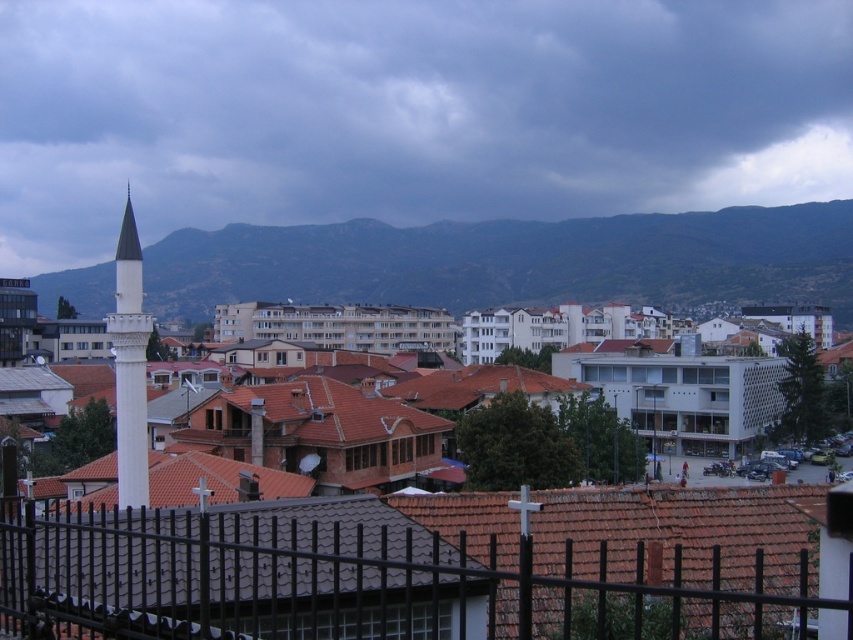
Can you confirm if dark gray cloud at upper center is shorter than white marble minaret at left?

No, dark gray cloud at upper center is not shorter than white marble minaret at left.

Can you confirm if dark gray cloud at upper center is bigger than white marble minaret at left?

Indeed, dark gray cloud at upper center has a larger size compared to white marble minaret at left.

At what (x,y) coordinates should I click in order to perform the action: click on dark gray cloud at upper center. Please return your answer as a coordinate pair (x, y). This screenshot has width=853, height=640. Looking at the image, I should click on (408, 113).

Locate an element on the screen. dark gray cloud at upper center is located at coordinates (408, 113).

Does dark gray cloud at upper center appear over black metal fence at lower center?

Correct, dark gray cloud at upper center is located above black metal fence at lower center.

Where is `dark gray cloud at upper center`? This screenshot has height=640, width=853. dark gray cloud at upper center is located at coordinates (408, 113).

Which is behind, point (218, 161) or point (91, 513)?

Positioned behind is point (218, 161).

I want to click on dark gray cloud at upper center, so (x=408, y=113).

Between dark gray cloud at upper center and green textured mountain at upper center, which one has less height?

green textured mountain at upper center is shorter.

Does dark gray cloud at upper center have a lesser width compared to green textured mountain at upper center?

No, dark gray cloud at upper center is not thinner than green textured mountain at upper center.

Is point (364, 109) positioned behind point (491, 240)?

Yes.

The image size is (853, 640). I want to click on dark gray cloud at upper center, so click(408, 113).